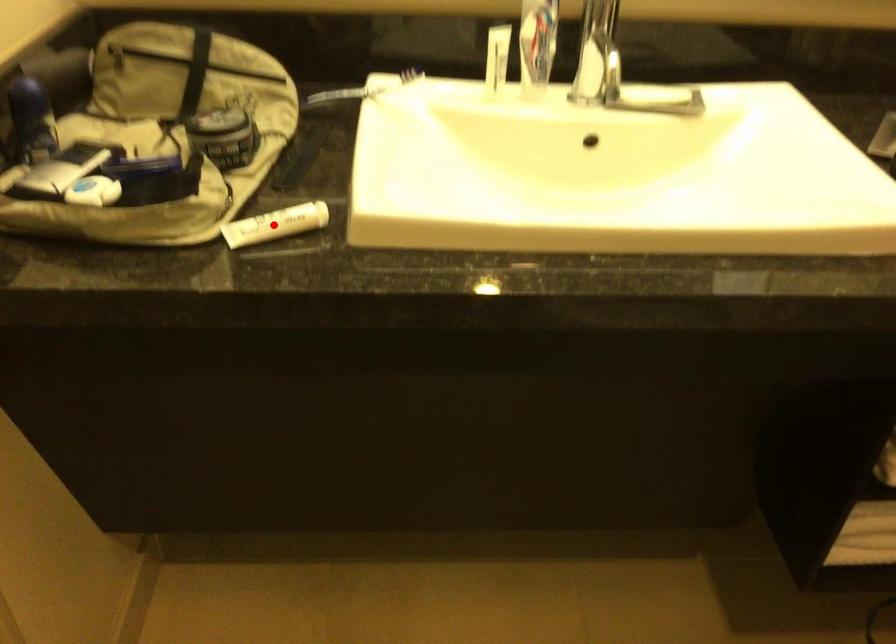
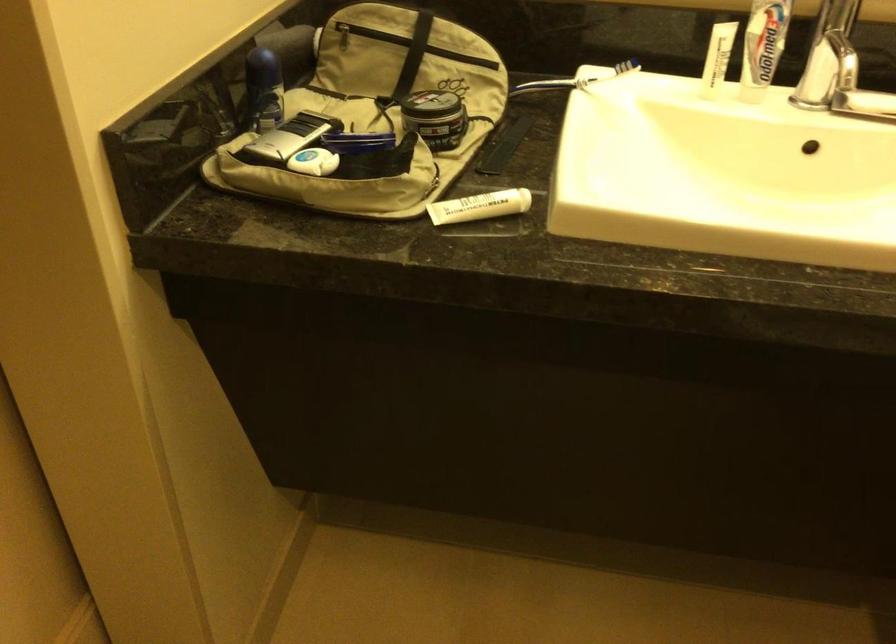
The point at the highlighted location is marked in the first image. Where is the corresponding point in the second image?

(479, 205)